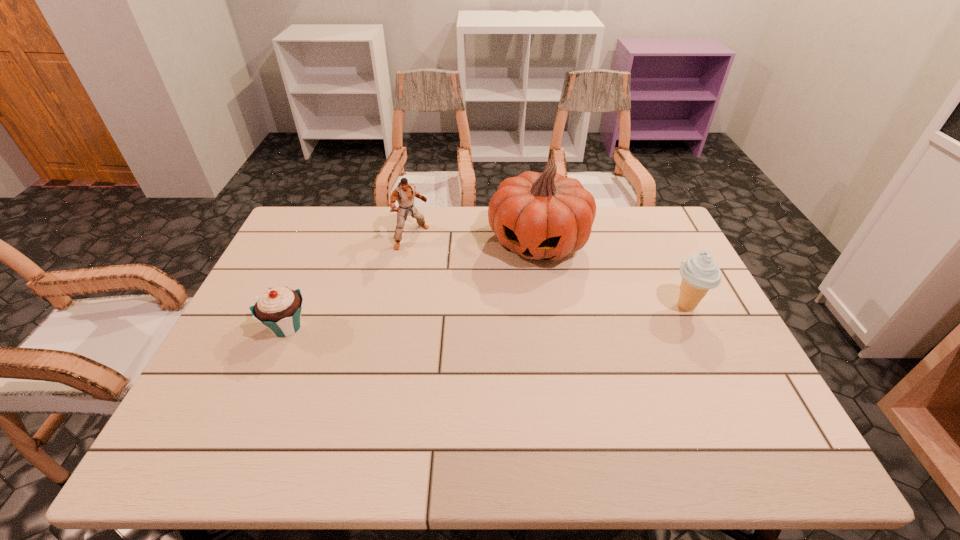
The width and height of the screenshot is (960, 540). What are the coordinates of `free region that satisfies the following two spatial constraints: 1. on the back side of the leftmost object; 2. on the left side of the puncher` in the screenshot? It's located at (325, 237).

You are a GUI agent. You are given a task and a screenshot of the screen. Output one action in this format:
    pyautogui.click(x=<x>, y=<y>)
    Task: Click on the free space that satisfies the following two spatial constraints: 1. on the back side of the shortest object; 2. on the left side of the rightmost object
    Image resolution: width=960 pixels, height=540 pixels.
    Given the screenshot: What is the action you would take?
    pyautogui.click(x=296, y=306)